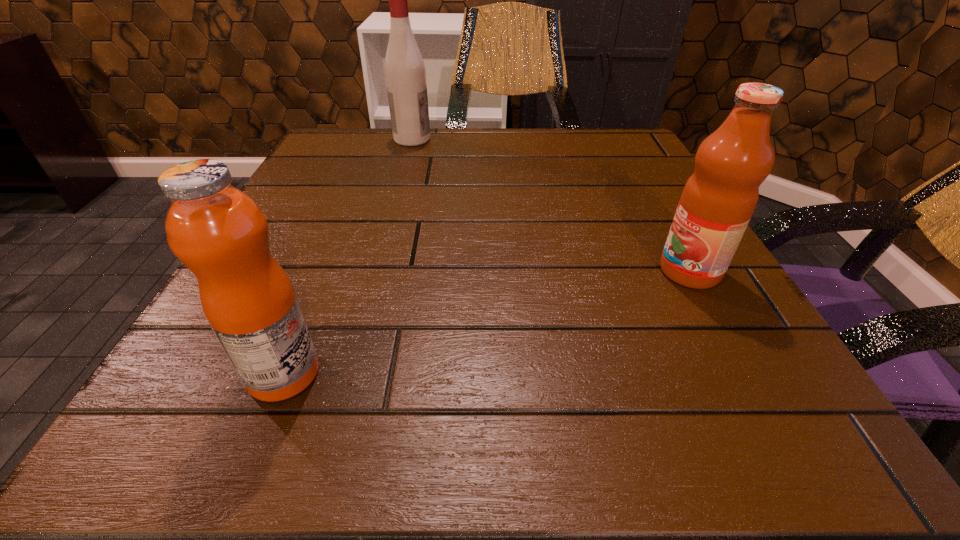
Locate an element on the screen. free space at the right edge of the desktop is located at coordinates (652, 235).

Identify the location of vacant space at the far left corner of the desktop. (314, 155).

At what (x,y) coordinates should I click in order to perform the action: click on vacant region at the near left corner of the desktop. Please return your answer as a coordinate pair (x, y). This screenshot has height=540, width=960. Looking at the image, I should click on (216, 414).

You are a GUI agent. You are given a task and a screenshot of the screen. Output one action in this format:
    pyautogui.click(x=<x>, y=<y>)
    Task: Click on the vacant space at the far right corner of the desktop
    The image size is (960, 540).
    Given the screenshot: What is the action you would take?
    pyautogui.click(x=636, y=140)

Find the location of a particular element. The height and width of the screenshot is (540, 960). free area in between the alcohol and the nearer fruit juice is located at coordinates (348, 256).

At what (x,y) coordinates should I click in order to perform the action: click on free space between the rightmost object and the alcohol. Please return your answer as a coordinate pair (x, y). Image resolution: width=960 pixels, height=540 pixels. Looking at the image, I should click on point(551,205).

Find the location of `blank region between the nearest object and the right fruit juice`. blank region between the nearest object and the right fruit juice is located at coordinates (487, 322).

Image resolution: width=960 pixels, height=540 pixels. Find the location of `vacant region between the rightmost object and the alcohol`. vacant region between the rightmost object and the alcohol is located at coordinates (551, 205).

Find the location of `empty space between the second nearest object and the nearest object`. empty space between the second nearest object and the nearest object is located at coordinates (487, 322).

The height and width of the screenshot is (540, 960). I want to click on vacant area that lies between the tallest object and the rightmost object, so click(551, 205).